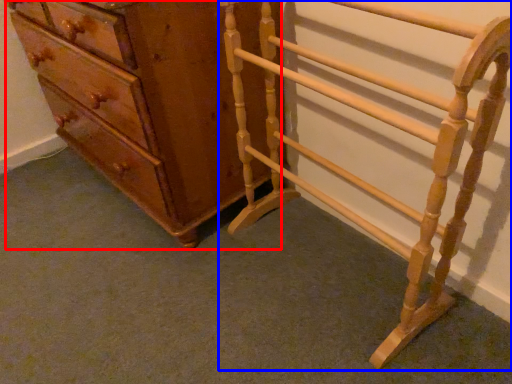
Question: Which of the following is the closest to the observer, chest of drawers (highlighted by a red box) or furniture (highlighted by a blue box)?

Choices:
 (A) chest of drawers
 (B) furniture

Answer: (B)